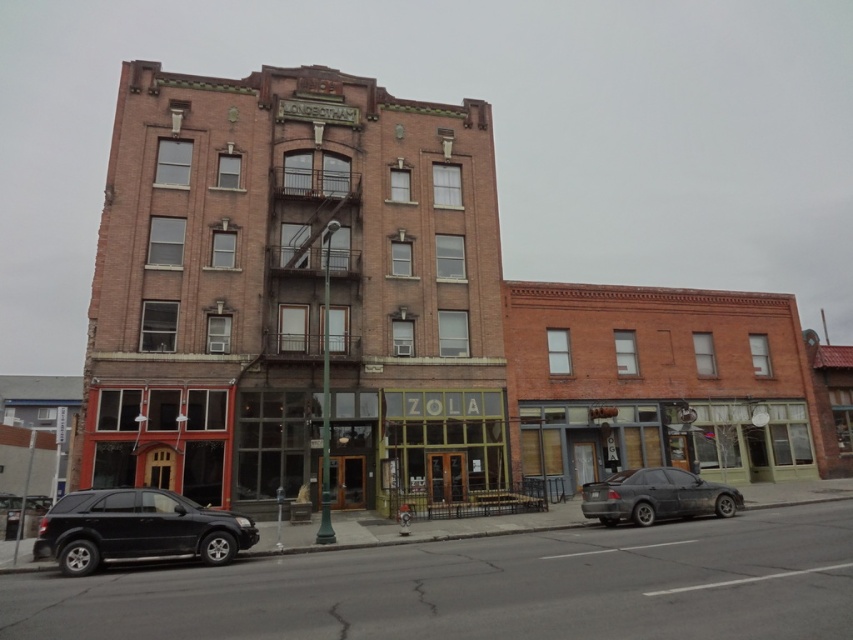
You are a pedestrian standing on the sidewalk in front of the building. You need to cross the street safely. Which vehicle, the matte black suv at lower left or the dark gray matte sedan at lower right, is closer to you on the sidewalk?

The matte black suv at lower left is closer to you on the sidewalk because it is positioned above the dark gray matte sedan at lower right, indicating it is nearer in the visual perspective.

You are a pedestrian standing on the sidewalk in front of the building. You need to cross the street but want to ensure there is enough space between the two vehicles to avoid them. Can you walk safely between the matte black suv at lower left and the dark gray matte sedan at lower right?

The matte black suv at lower left is larger in size than the dark gray matte sedan at lower right. Since the suv is larger, the space between them may be sufficient for a pedestrian to walk through safely, but the exact distance isn

You are standing on the sidewalk in front of the building. You see a point marked at coordinates (137, 529). What object is located at that point?

The point at coordinates (137, 529) corresponds to the matte black suv at lower left.